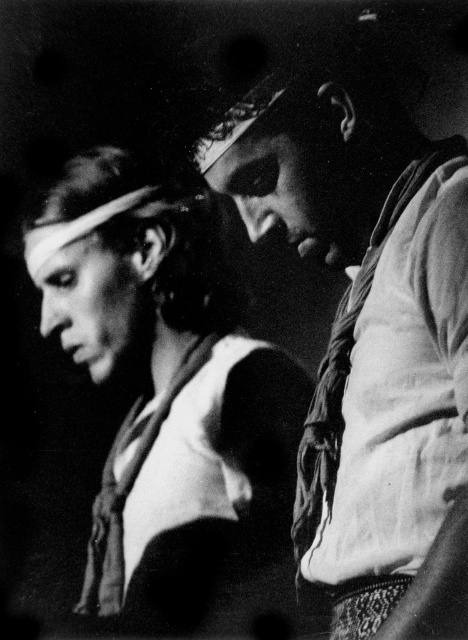
You are a costume designer preparing for a play. You have two items from the image to choose from for a character who needs a wide accessory. Which item should you select between the white fabric shirt at right and the matte white scarf at center?

The matte white scarf at center has a greater width than the white fabric shirt at right, so you should choose the matte white scarf at center for the wide accessory.

You are a photographer adjusting your camera settings in this dimly lit scene. You want to focus on the white fabric shirt at right and the matte white scarf at center. Which object should you prioritize focusing on first to ensure it appears sharp in the photo?

The white fabric shirt at right is closer to the viewer than the matte white scarf at center, so you should prioritize focusing on the white fabric shirt at right first to ensure it appears sharp in the photo.

From the picture: You are a stagehand who needs to adjust the lighting for a performance. You have a spotlight that has a 3.5 feet range. You need to light up both the white fabric shirt at right and the matte white scarf at center. Can you do this with just one spotlight?

The white fabric shirt at right is 3.88 feet away from the matte white scarf at center. Since the spotlight only has a 3.5 feet range, it cannot cover the distance between them. You will need at least two spotlights to light up both objects.